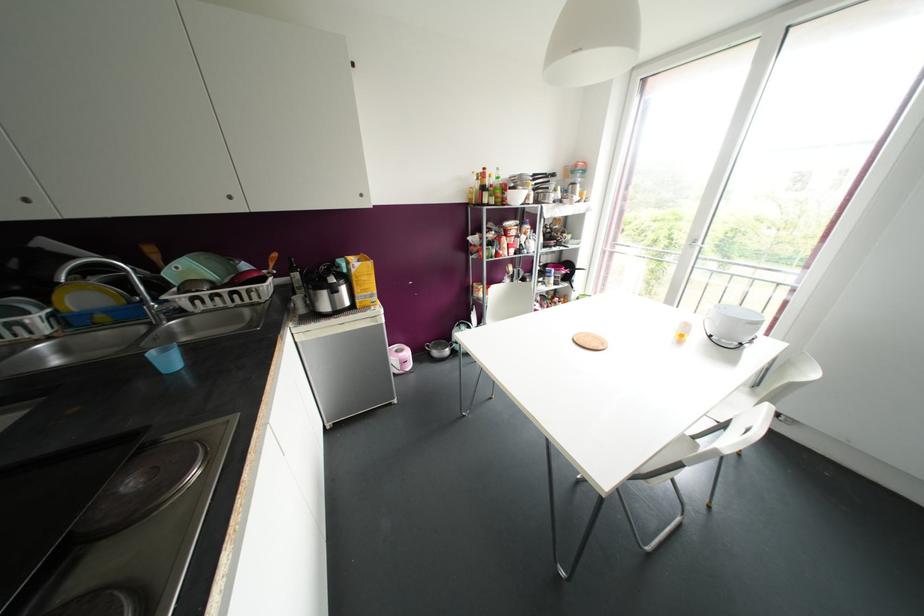
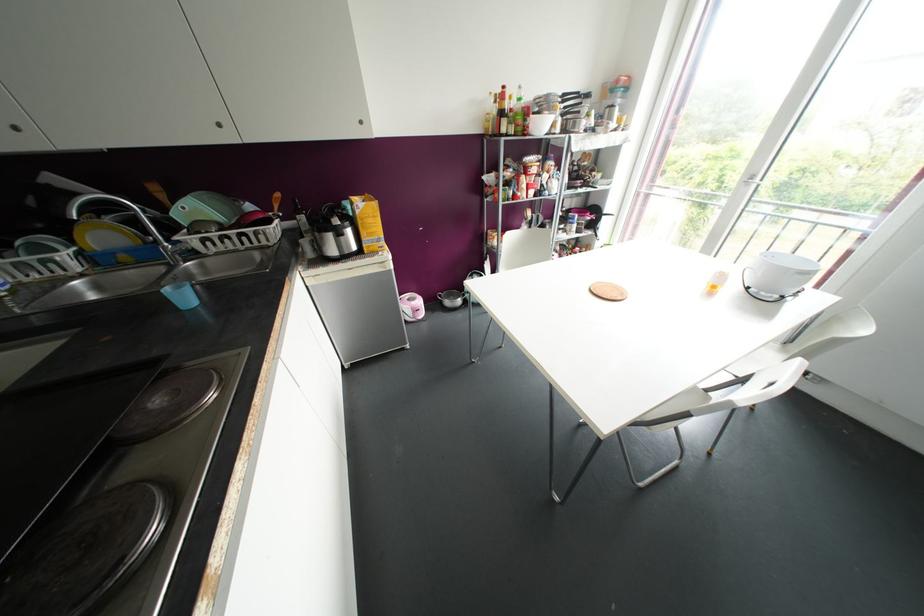
Locate, in the second image, the point that corresponds to point 360,195 in the first image.

(360, 122)